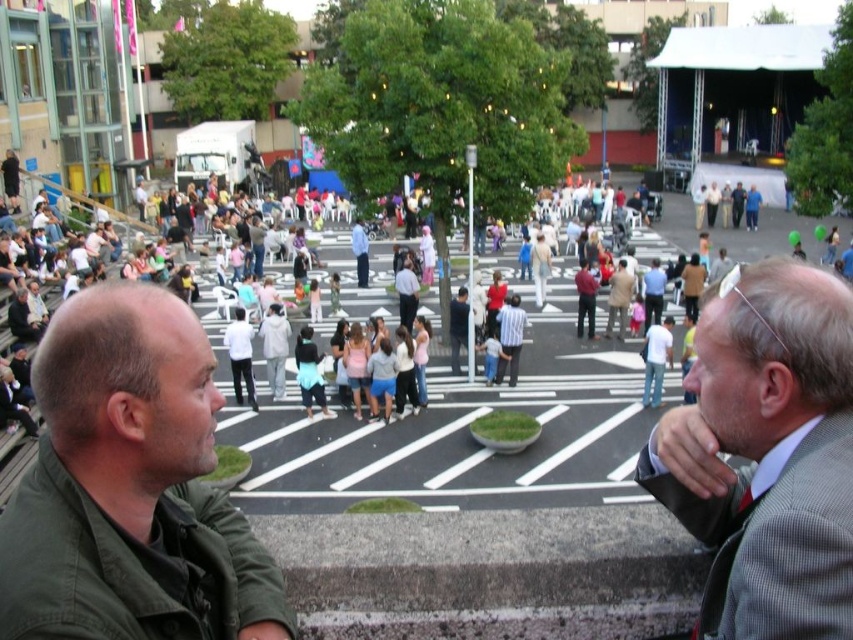
Question: Can you confirm if green matte jacket at lower left is bigger than gray wool suit at center?

Choices:
 (A) yes
 (B) no

Answer: (B)

Question: Which point appears closest to the camera in this image?

Choices:
 (A) (4, 592)
 (B) (747, 508)

Answer: (A)

Question: Is green matte jacket at lower left positioned in front of gray wool suit at center?

Choices:
 (A) no
 (B) yes

Answer: (B)

Question: Is green matte jacket at lower left positioned before gray wool suit at center?

Choices:
 (A) no
 (B) yes

Answer: (B)

Question: Which of the following is the closest to the observer?

Choices:
 (A) (746, 355)
 (B) (90, 508)

Answer: (B)